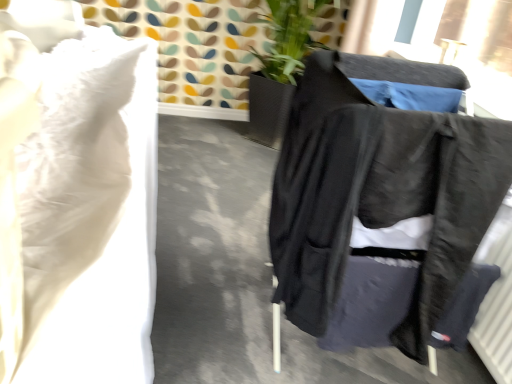
Question: Is white soft pillow at upper left wider or thinner than black fabric jacket at right?

Choices:
 (A) thin
 (B) wide

Answer: (B)

Question: Visually, is white soft pillow at upper left positioned to the left or to the right of black fabric jacket at right?

Choices:
 (A) right
 (B) left

Answer: (B)

Question: Does point (47, 377) appear closer or farther from the camera than point (385, 228)?

Choices:
 (A) farther
 (B) closer

Answer: (B)

Question: In terms of width, does black fabric jacket at right look wider or thinner when compared to white soft pillow at upper left?

Choices:
 (A) wide
 (B) thin

Answer: (B)

Question: Visually, is black fabric jacket at right positioned to the left or to the right of white soft pillow at upper left?

Choices:
 (A) left
 (B) right

Answer: (B)

Question: Considering the positions of black fabric jacket at right and white soft pillow at upper left in the image, is black fabric jacket at right taller or shorter than white soft pillow at upper left?

Choices:
 (A) tall
 (B) short

Answer: (A)

Question: In the image, is black fabric jacket at right positioned in front of or behind white soft pillow at upper left?

Choices:
 (A) behind
 (B) front

Answer: (A)